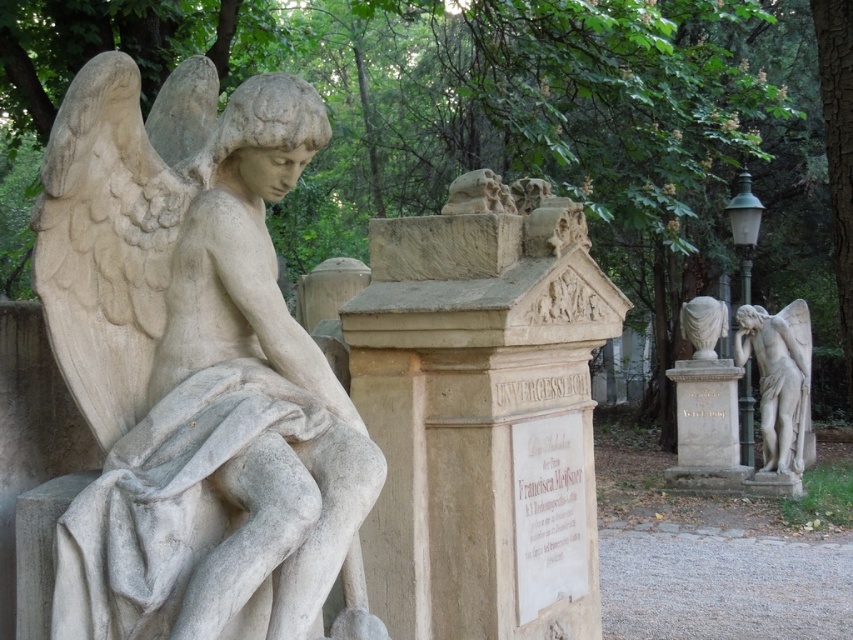
Can you confirm if white stone angel at left is positioned to the left of matte stone angel at right?

Indeed, white stone angel at left is positioned on the left side of matte stone angel at right.

Who is more distant from viewer, (111, 637) or (747, 316)?

The point (747, 316) is behind.

Between point (140, 468) and point (759, 397), which one is positioned in front?

Point (140, 468)

Find the location of a particular element. This screenshot has width=853, height=640. white stone angel at left is located at coordinates (194, 369).

Which of these two, white stone angel at left or white marble statue at center, stands shorter?

white marble statue at center is shorter.

In the scene shown: Is the position of white stone angel at left more distant than that of white marble statue at center?

No, white stone angel at left is in front of white marble statue at center.

Is point (206, 355) positioned in front of point (712, 333)?

Yes, point (206, 355) is in front of point (712, 333).

I want to click on white stone angel at left, so click(194, 369).

Can you confirm if white stone angel at left is wider than white marble bust at center?

Yes, white stone angel at left is wider than white marble bust at center.

This screenshot has height=640, width=853. In order to click on white stone angel at left in this screenshot , I will do `click(194, 369)`.

The height and width of the screenshot is (640, 853). What do you see at coordinates (194, 369) in the screenshot? I see `white stone angel at left` at bounding box center [194, 369].

At what (x,y) coordinates should I click in order to perform the action: click on white stone angel at left. Please return your answer as a coordinate pair (x, y). This screenshot has height=640, width=853. Looking at the image, I should click on (194, 369).